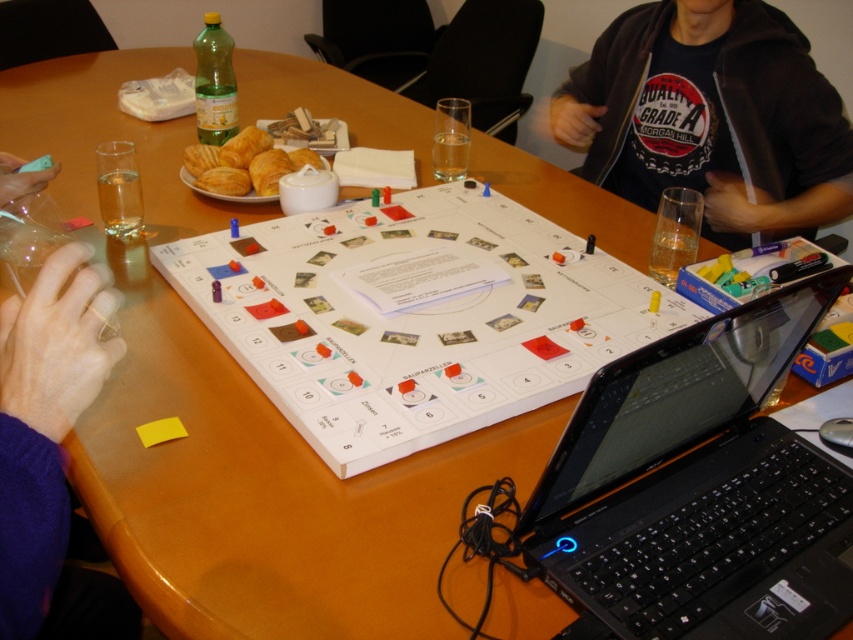
From the picture: You are a guest at this game night and want to grab a golden flaky croissant at center. There is a purple fabric hand at lower left blocking your path. Can you reach the croissant without moving the hand?

The purple fabric hand at lower left is closer to the viewer than golden flaky croissant at center, so the hand is in front of the croissant. You cannot reach the croissant without moving the hand.

You are a player sitting at the round wooden table and want to reach both the point at (817, 115) and the point at (199, 186). Which point will you reach first if you move directly towards them?

You will reach point at (817, 115) first because it is closer to you than point at (199, 186), which is further away.